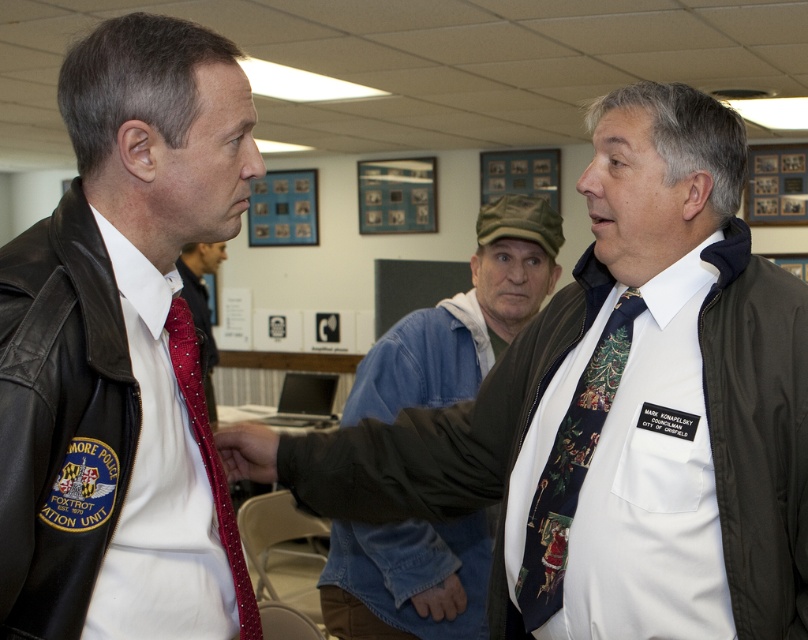
Question: Which of the following is the closest to the observer?

Choices:
 (A) dark green leather jacket at center
 (B) denim jacket at center

Answer: (A)

Question: Does leather jacket at left lie behind dark blue textured tie at center?

Choices:
 (A) no
 (B) yes

Answer: (A)

Question: Can you confirm if shiny red tie at center is thinner than matte black hand at center?

Choices:
 (A) yes
 (B) no

Answer: (B)

Question: Estimate the real-world distances between objects in this image. Which object is farther from the shiny red tie at center?

Choices:
 (A) denim jacket at center
 (B) leather jacket at left
 (C) dark green leather jacket at center
 (D) dark blue textured tie at center

Answer: (D)

Question: Considering the real-world distances, which object is farthest from the shiny red tie at center?

Choices:
 (A) matte black hand at center
 (B) dark blue textured tie at center
 (C) leather jacket at left

Answer: (B)

Question: Is dark green leather jacket at center further to camera compared to matte black hand at center?

Choices:
 (A) yes
 (B) no

Answer: (A)